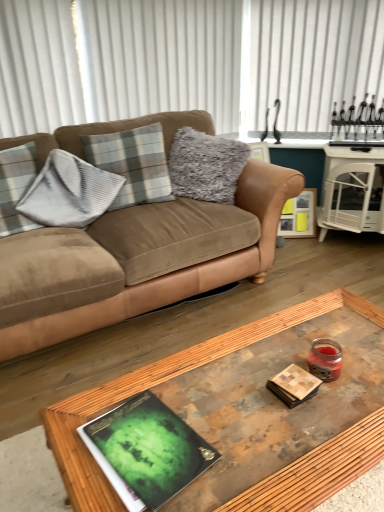
Question: From a real-world perspective, is wooden picture frame at right physically located above or below wooden glass coffee table at center?

Choices:
 (A) above
 (B) below

Answer: (B)

Question: Is wooden picture frame at right inside the boundaries of wooden glass coffee table at center, or outside?

Choices:
 (A) outside
 (B) inside

Answer: (A)

Question: Which is farther from the wooden glass coffee table at center?

Choices:
 (A) matte brown book at center
 (B) white glossy side table at right
 (C) gray plaid pillow at left, the second pillow when ordered from right to left
 (D) wooden picture frame at right
 (E) suede brown couch at upper left

Answer: (D)

Question: Considering the real-world distances, which object is closest to the suede brown couch at upper left?

Choices:
 (A) white glossy side table at right
 (B) green matte book at center
 (C) gray plaid pillow at left, the first pillow when ordered from left to right
 (D) wooden picture frame at right
 (E) wooden glass coffee table at center

Answer: (C)